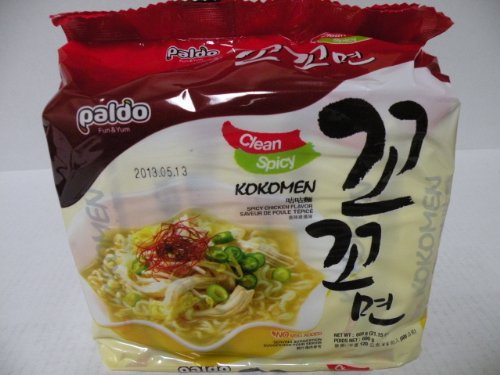
Identify the location of white wooden tabletop. Image resolution: width=500 pixels, height=375 pixels. (40, 306).